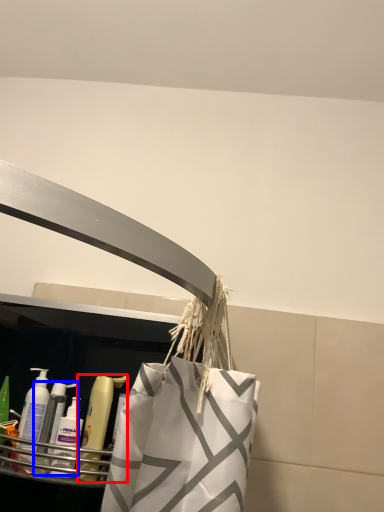
Question: Which object is closer to the camera taking this photo, mouthwash (highlighted by a red box) or cleaning product (highlighted by a blue box)?

Choices:
 (A) mouthwash
 (B) cleaning product

Answer: (A)